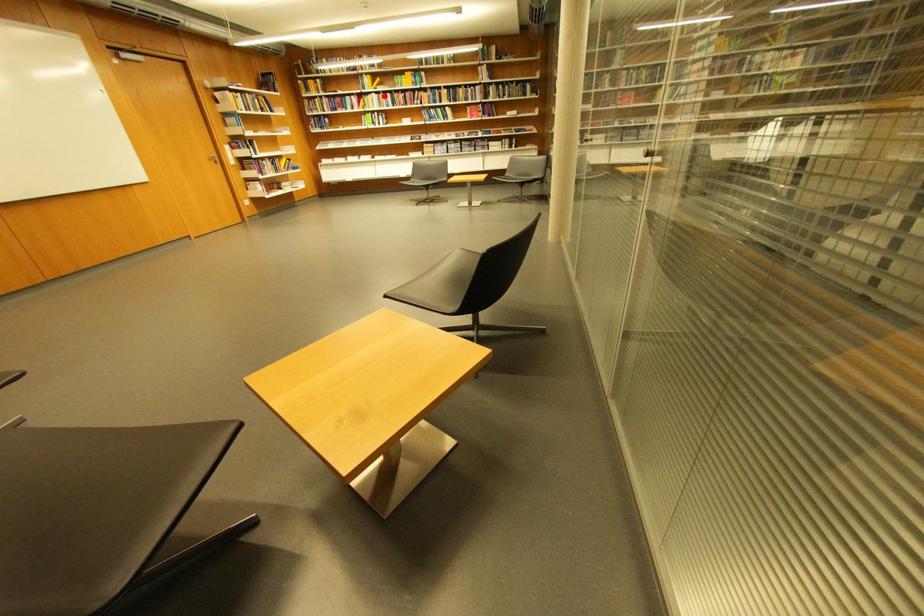
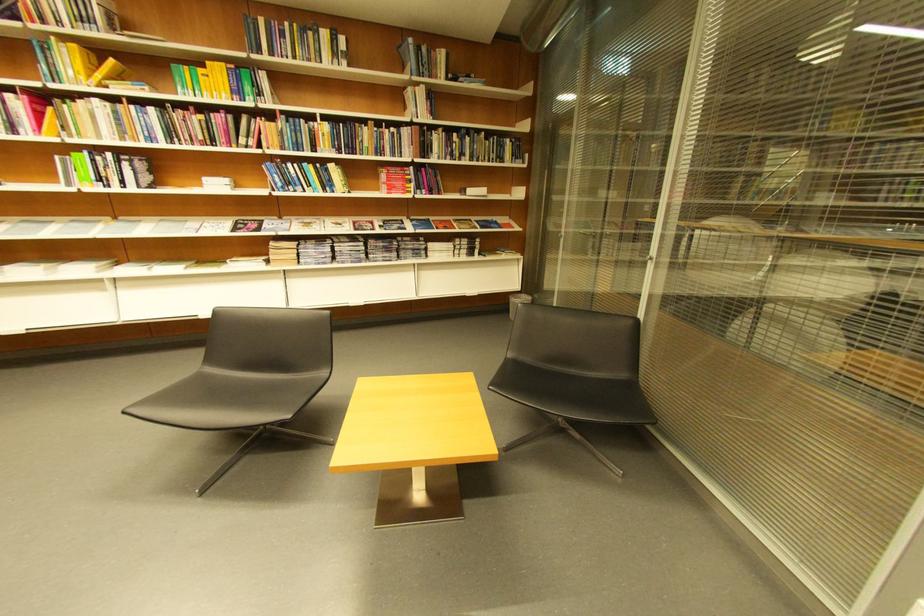
The point at the highlighted location is marked in the first image. Where is the corresponding point in the second image?

(106, 102)